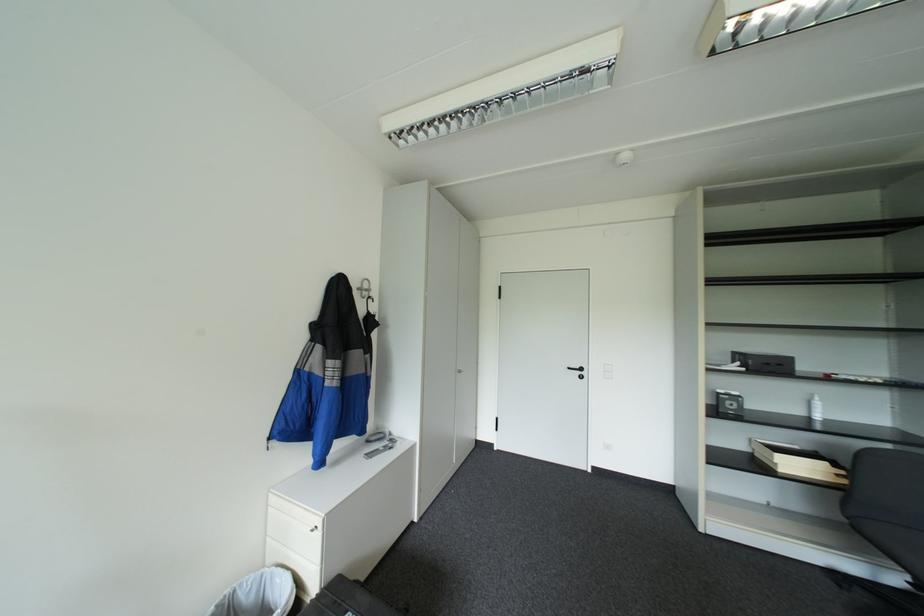
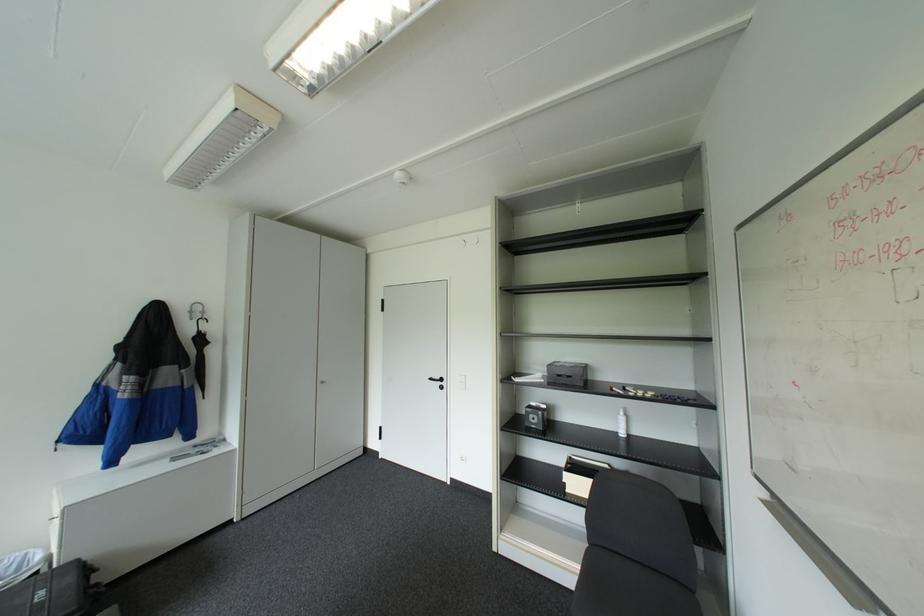
Question: In a continuous first-person perspective shot, in which direction is the camera moving?

Choices:
 (A) Left
 (B) Right
 (C) Forward
 (D) Backward

Answer: (B)